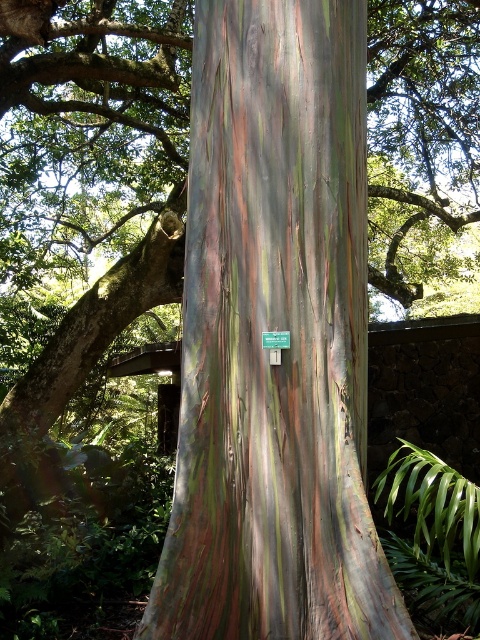
Does point (479, 513) come farther from viewer compared to point (276, 339)?

Yes.

Which is more to the left, rainbow bark eucalyptus at lower right or green plastic sign at center?

green plastic sign at center

Between point (471, 513) and point (268, 333), which one is positioned in front?

Point (471, 513) is in front.

Find the location of `rainbow bark eucalyptus at lower right`. rainbow bark eucalyptus at lower right is located at coordinates (432, 534).

Between point (207, 234) and point (264, 340), which one is positioned behind?

Positioned behind is point (207, 234).

Image resolution: width=480 pixels, height=640 pixels. What do you see at coordinates (275, 330) in the screenshot?
I see `rainbow bark tree trunk at center` at bounding box center [275, 330].

The width and height of the screenshot is (480, 640). I want to click on rainbow bark tree trunk at center, so click(x=275, y=330).

Is point (254, 374) farther from viewer compared to point (434, 499)?

No, (254, 374) is in front of (434, 499).

Is point (212, 120) in front of point (459, 515)?

No, it is behind (459, 515).

Locate an element on the screen. This screenshot has height=640, width=480. rainbow bark tree trunk at center is located at coordinates (275, 330).